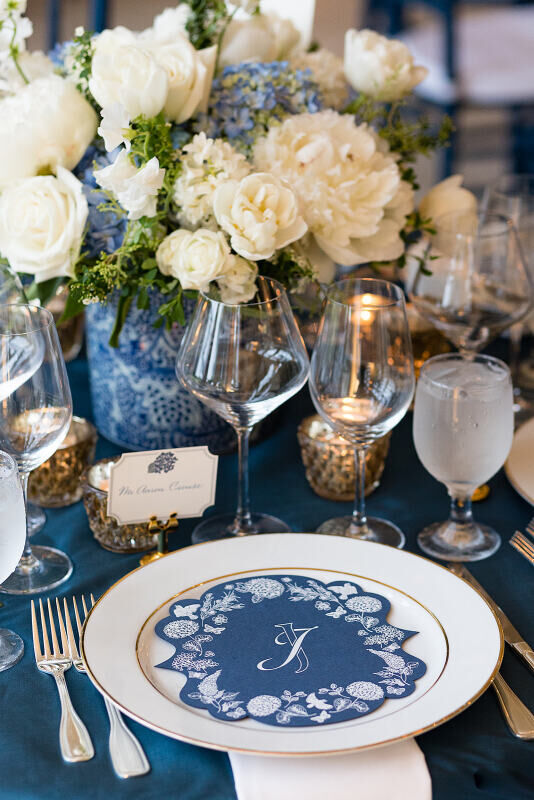
This screenshot has width=534, height=800. I want to click on floral bouquet, so point(232,130).